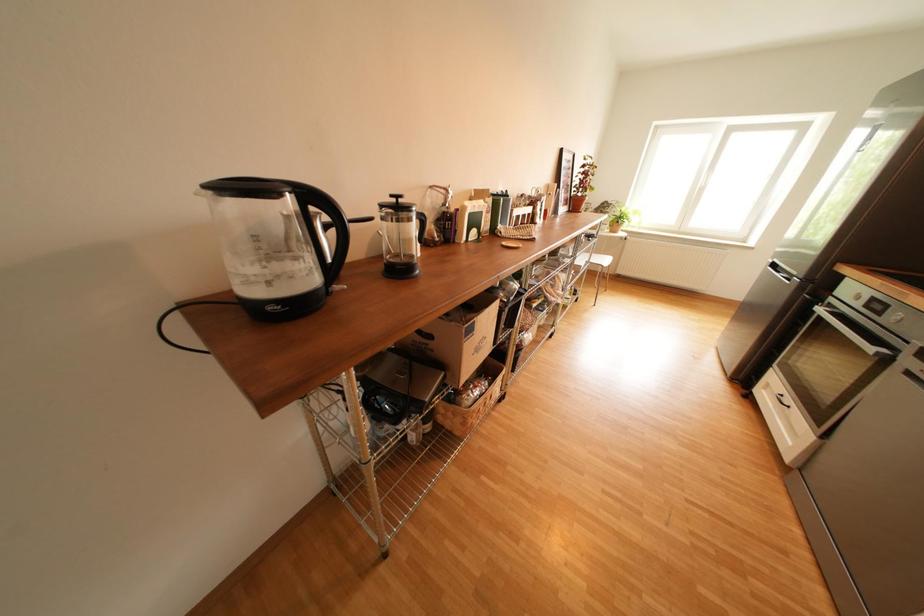
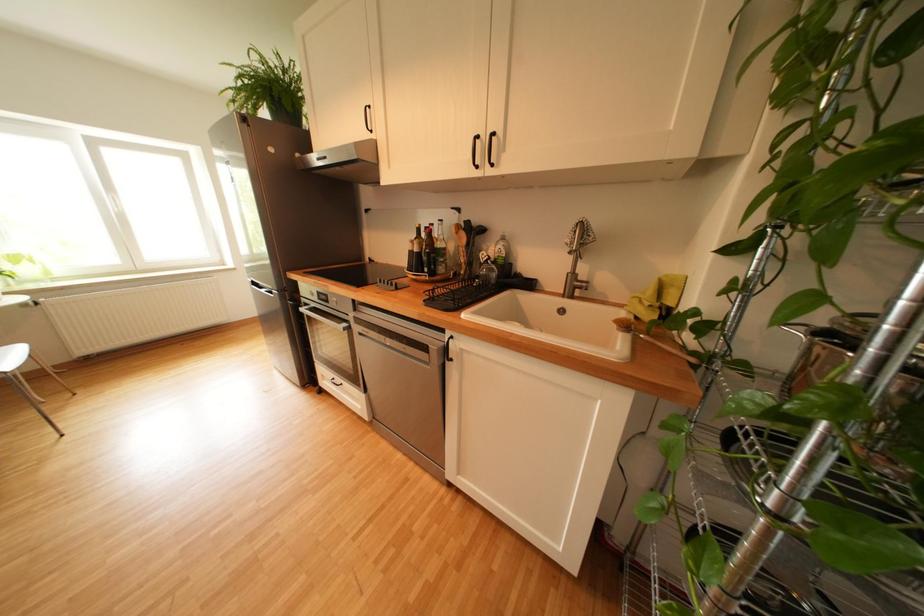
The first image is from the beginning of the video and the second image is from the end. How did the camera likely rotate when shooting the video?

The camera rotated toward right-down.